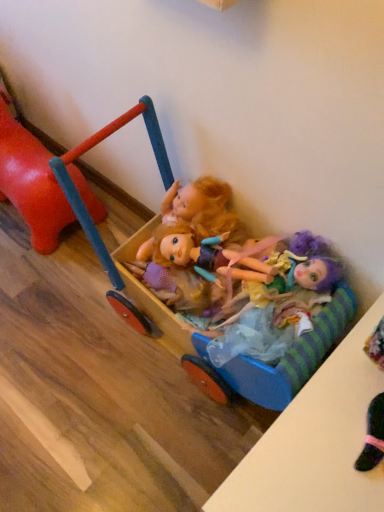
Question: From the image's perspective, is wooden cart at center, which is the second toy from left to right, located beneath multicolored fabric doll at center?

Choices:
 (A) yes
 (B) no

Answer: (B)

Question: Does wooden cart at center, which is the second toy from left to right, have a smaller size compared to multicolored fabric doll at center?

Choices:
 (A) yes
 (B) no

Answer: (B)

Question: Is wooden cart at center, which is the first toy from right to left, bigger than multicolored fabric doll at center?

Choices:
 (A) yes
 (B) no

Answer: (A)

Question: Considering the relative sizes of wooden cart at center, which is the second toy from left to right, and multicolored fabric doll at center in the image provided, is wooden cart at center, which is the second toy from left to right, shorter than multicolored fabric doll at center?

Choices:
 (A) yes
 (B) no

Answer: (B)

Question: Could you tell me if wooden cart at center, which is the second toy from left to right, is facing multicolored fabric doll at center?

Choices:
 (A) no
 (B) yes

Answer: (B)

Question: From a real-world perspective, is wooden cart at center, which is the second toy from left to right, on top of multicolored fabric doll at center?

Choices:
 (A) no
 (B) yes

Answer: (A)

Question: Can you confirm if multicolored fabric doll at center is thinner than rubberized red horse at left, the first toy viewed from the left?

Choices:
 (A) yes
 (B) no

Answer: (A)

Question: Is the position of multicolored fabric doll at center more distant than that of rubberized red horse at left, the 2th toy when ordered from right to left?

Choices:
 (A) yes
 (B) no

Answer: (B)

Question: Is multicolored fabric doll at center looking in the opposite direction of rubberized red horse at left, the first toy viewed from the left?

Choices:
 (A) yes
 (B) no

Answer: (B)

Question: Considering the relative sizes of multicolored fabric doll at center and rubberized red horse at left, the 2th toy when ordered from right to left, in the image provided, is multicolored fabric doll at center wider than rubberized red horse at left, the 2th toy when ordered from right to left,?

Choices:
 (A) yes
 (B) no

Answer: (B)

Question: From the image's perspective, is multicolored fabric doll at center located beneath rubberized red horse at left, the 2th toy when ordered from right to left?

Choices:
 (A) yes
 (B) no

Answer: (A)

Question: Considering the relative sizes of multicolored fabric doll at center and rubberized red horse at left, the 2th toy when ordered from right to left, in the image provided, is multicolored fabric doll at center shorter than rubberized red horse at left, the 2th toy when ordered from right to left,?

Choices:
 (A) yes
 (B) no

Answer: (A)

Question: Is rubberized red horse at left, the 2th toy when ordered from right to left, outside multicolored fabric doll at center?

Choices:
 (A) yes
 (B) no

Answer: (A)